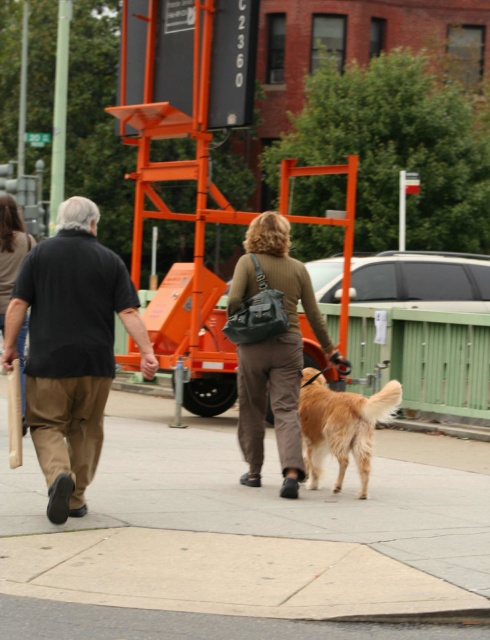
Can you confirm if brown textured pants at center is bigger than golden fur dog at center?

Yes.

Between brown textured pants at center and golden fur dog at center, which one is positioned lower?

golden fur dog at center is below.

Locate an element on the screen. brown textured pants at center is located at coordinates (272, 349).

Does gray concrete sidewalk at center have a greater height compared to brown textured pants at center?

Incorrect, gray concrete sidewalk at center's height is not larger of brown textured pants at center's.

Measure the distance from gray concrete sidewalk at center to brown textured pants at center.

A distance of 3.26 meters exists between gray concrete sidewalk at center and brown textured pants at center.

Find the location of `gray concrete sidewalk at center`. gray concrete sidewalk at center is located at coordinates (245, 540).

Can you confirm if black cotton shirt at left is shorter than golden fur dog at center?

Incorrect, black cotton shirt at left's height does not fall short of golden fur dog at center's.

Who is positioned more to the right, black cotton shirt at left or golden fur dog at center?

golden fur dog at center is more to the right.

This screenshot has height=640, width=490. I want to click on black cotton shirt at left, so click(x=72, y=348).